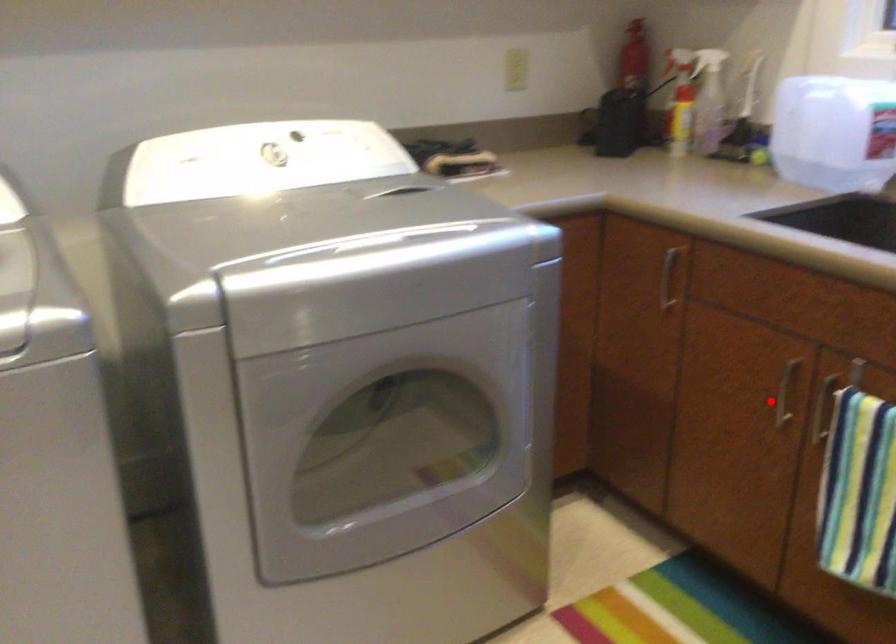
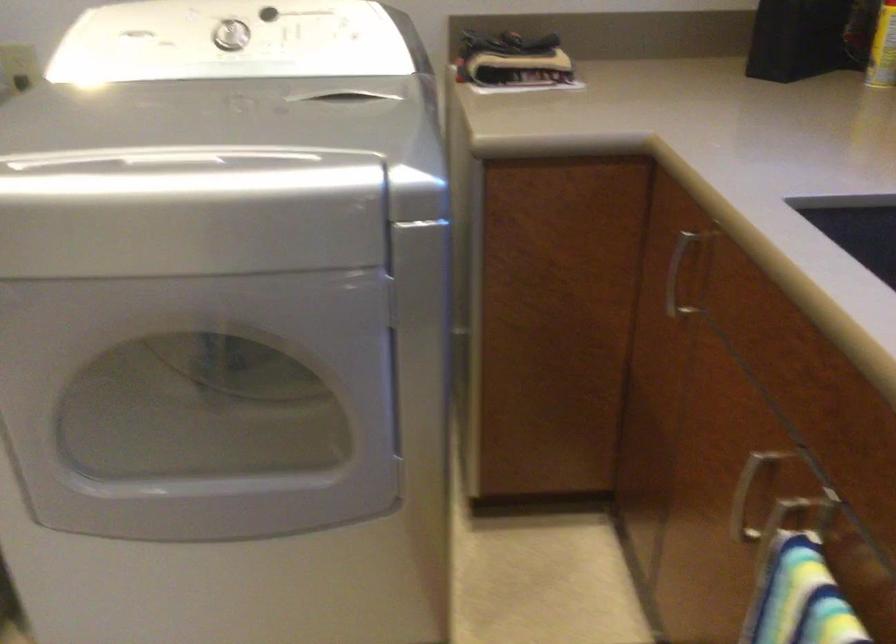
Where in the second image is the point corresponding to the highlighted location from the first image?

(745, 497)